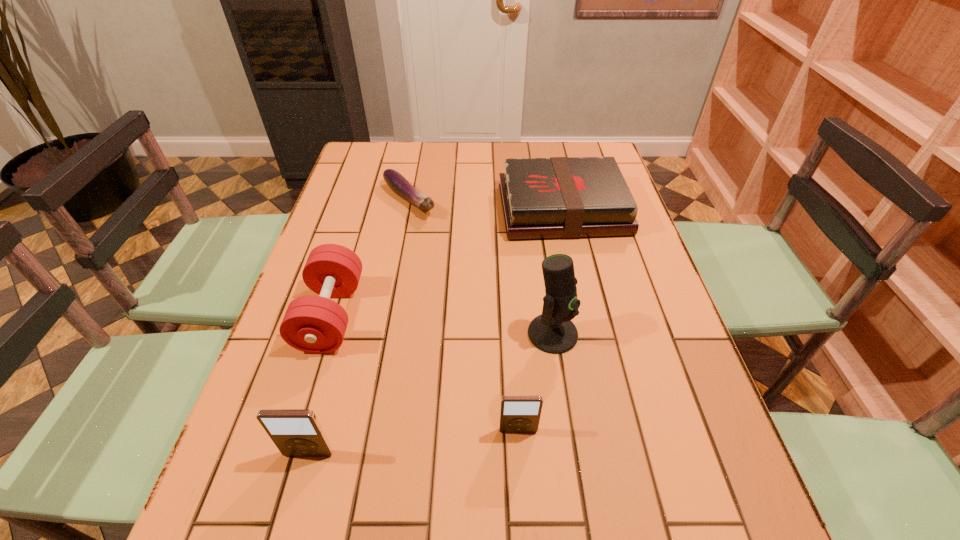
Where is `the fifth shortest object`? The height and width of the screenshot is (540, 960). the fifth shortest object is located at coordinates (296, 432).

Find the location of `the nearest object`. the nearest object is located at coordinates (296, 432).

Locate an element on the screen. Image resolution: width=960 pixels, height=540 pixels. the farther iPod is located at coordinates (518, 413).

The height and width of the screenshot is (540, 960). I want to click on the right iPod, so click(518, 413).

Locate an element on the screen. This screenshot has width=960, height=540. the tallest object is located at coordinates (553, 332).

Identify the location of the shortest object. The image size is (960, 540). (398, 184).

Find the location of a particular element. The width and height of the screenshot is (960, 540). hardback book is located at coordinates (558, 197).

Locate an element on the screen. The height and width of the screenshot is (540, 960). dumbbell is located at coordinates (313, 324).

Locate an element on the screen. This screenshot has width=960, height=540. free space located 0.080m on the front-facing side of the fifth farthest object is located at coordinates (521, 477).

Image resolution: width=960 pixels, height=540 pixels. I want to click on vacant space located 0.150m on the right of the tallest object, so click(644, 334).